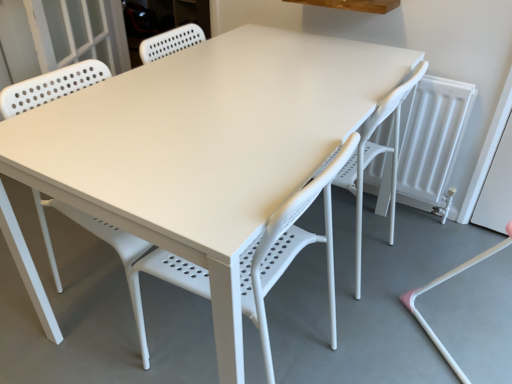
Question: Looking at their shapes, would you say white plastic chair at center is wider or thinner than white plastic swivel chair at lower right?

Choices:
 (A) thin
 (B) wide

Answer: (A)

Question: Is white plastic chair at center situated inside white plastic swivel chair at lower right or outside?

Choices:
 (A) inside
 (B) outside

Answer: (B)

Question: Based on their sizes in the image, would you say white plastic chair at center is bigger or smaller than white plastic swivel chair at lower right?

Choices:
 (A) small
 (B) big

Answer: (A)

Question: Based on their sizes in the image, would you say white plastic swivel chair at lower right is bigger or smaller than white plastic chair at center?

Choices:
 (A) small
 (B) big

Answer: (B)

Question: In terms of width, does white plastic swivel chair at lower right look wider or thinner when compared to white plastic chair at center?

Choices:
 (A) wide
 (B) thin

Answer: (A)

Question: Considering the positions of point (360, 241) and point (259, 251), is point (360, 241) closer or farther from the camera than point (259, 251)?

Choices:
 (A) closer
 (B) farther

Answer: (B)

Question: From a real-world perspective, relative to white plastic chair at center, is white plastic swivel chair at lower right vertically above or below?

Choices:
 (A) above
 (B) below

Answer: (B)